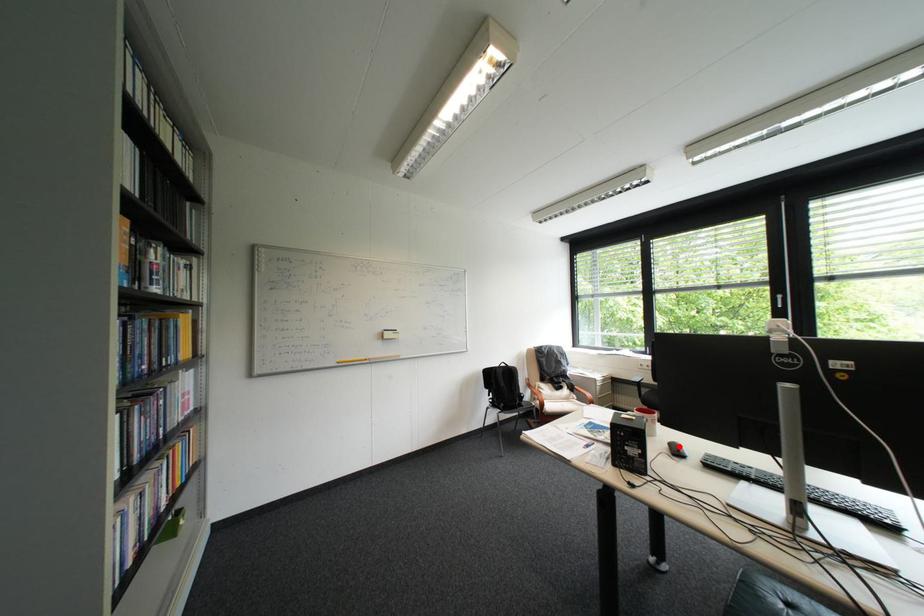
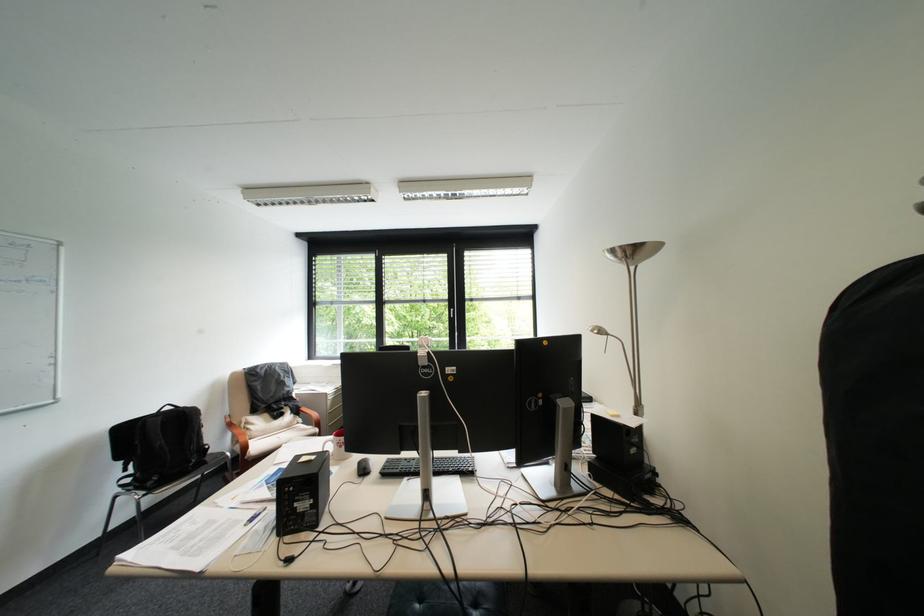
The point at the highlighted location is marked in the first image. Where is the corresponding point in the second image?

(369, 467)